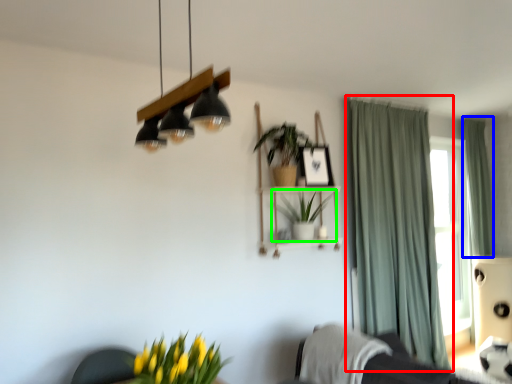
Question: Considering the real-world distances, which object is farthest from curtain (highlighted by a red box)? curtain (highlighted by a blue box) or houseplant (highlighted by a green box)?

Choices:
 (A) curtain
 (B) houseplant

Answer: (A)